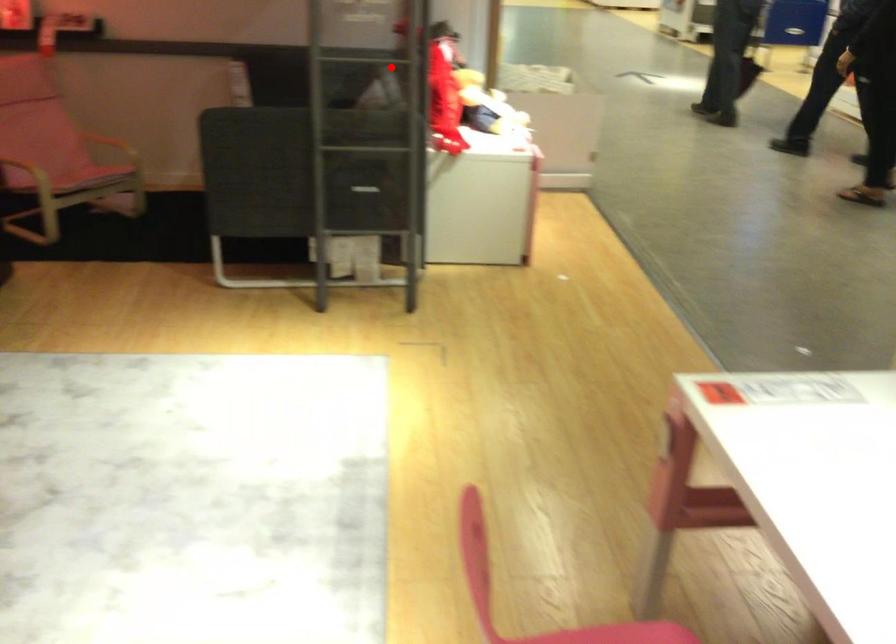
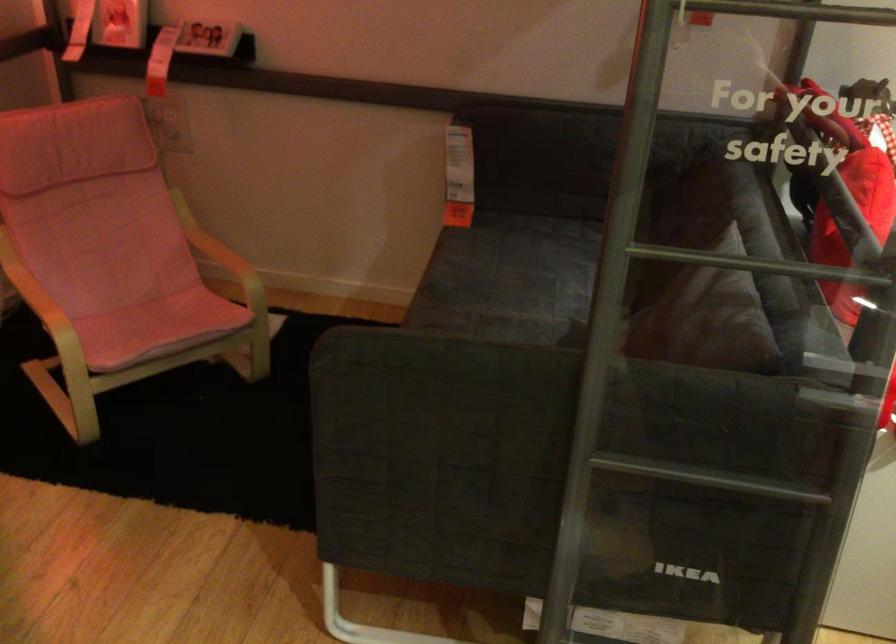
Question: I am providing you with two images of the same scene from different viewpoints. Image1 has a red point marked. In image2, the corresponding 3D location appears at what relative position? Reply with the corresponding letter.

Choices:
 (A) Closer
 (B) Farther

Answer: (A)